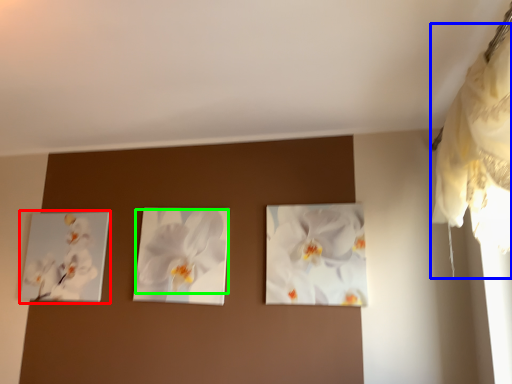
Question: Which is nearer to the picture frame (highlighted by a red box)? curtain (highlighted by a blue box) or flower (highlighted by a green box).

Choices:
 (A) curtain
 (B) flower

Answer: (B)